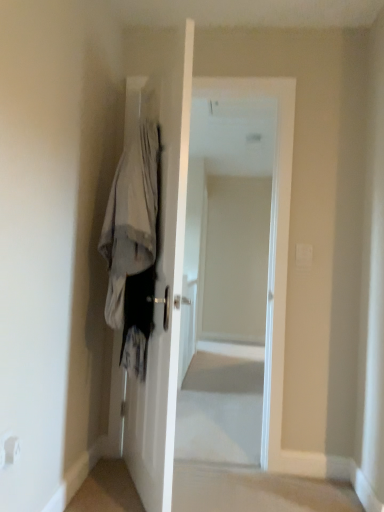
Locate an element on the screen. vacant space in white fabric coat at left (from a real-world perspective) is located at coordinates (121, 497).